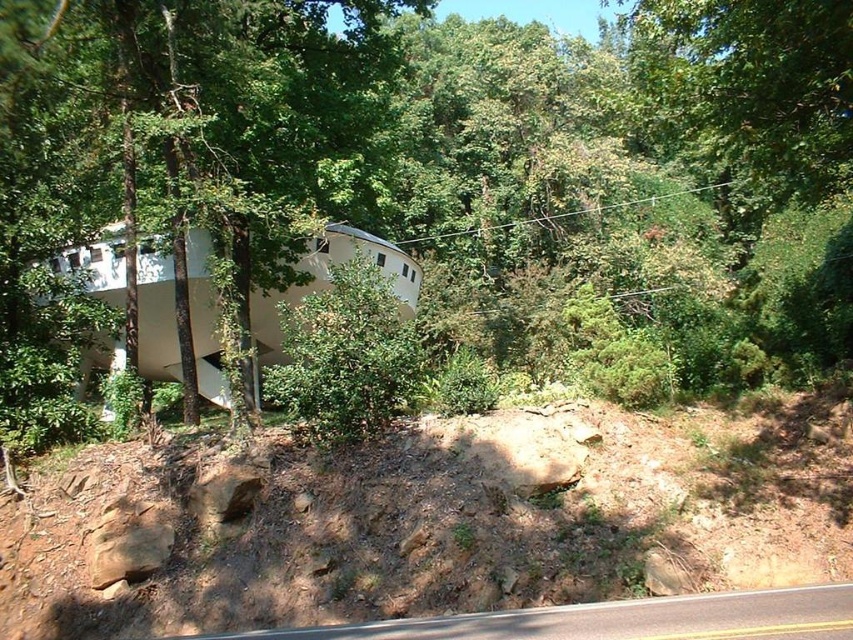
Question: Which of the following is the closest to the observer?

Choices:
 (A) 740,476
 (B) 828,16

Answer: (B)

Question: Can you confirm if green leafy tree at center is wider than dull brown dirt at lower center?

Choices:
 (A) no
 (B) yes

Answer: (B)

Question: Which point is closer to the camera?

Choices:
 (A) (97, 205)
 (B) (746, 470)

Answer: (B)

Question: Does green leafy tree at center appear on the right side of dull brown dirt at lower center?

Choices:
 (A) yes
 (B) no

Answer: (A)

Question: Which point is farther from the camera taking this photo?

Choices:
 (A) (44, 38)
 (B) (39, 531)

Answer: (A)

Question: Is green leafy tree at center further to camera compared to dull brown dirt at lower center?

Choices:
 (A) no
 (B) yes

Answer: (A)